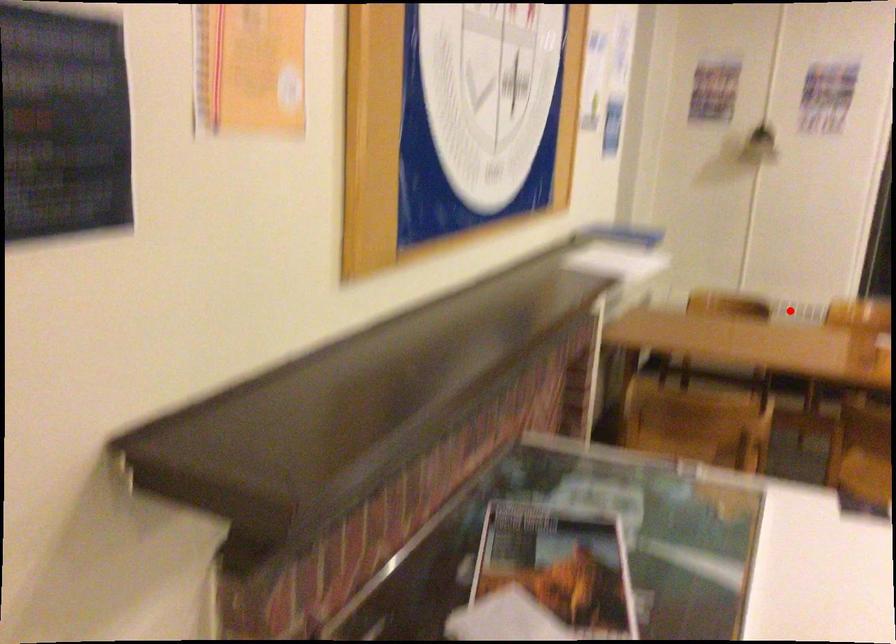
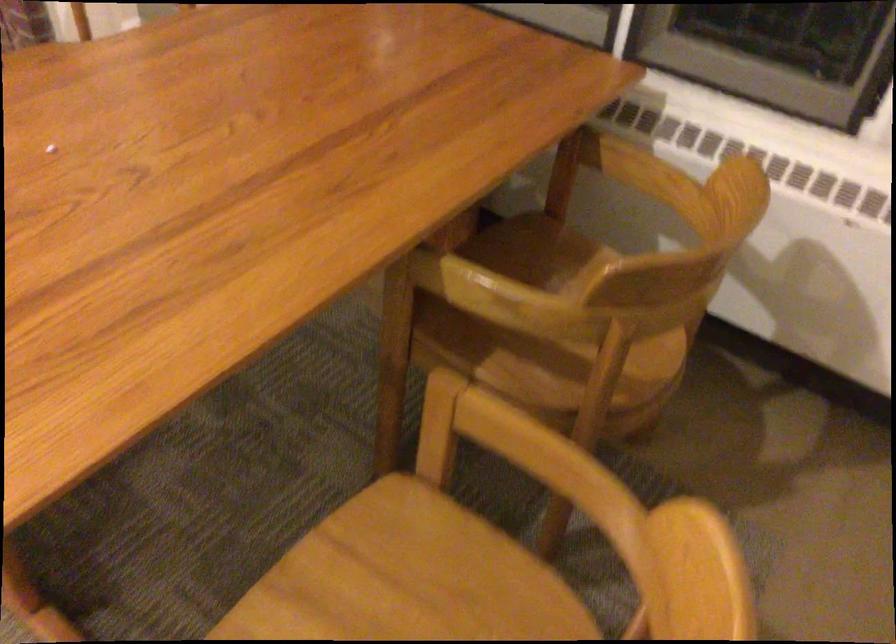
Question: A red point is marked in image1. In image2, is the corresponding 3D point closer to the camera or farther? Reply with the corresponding letter.

Choices:
 (A) The corresponding 3D point is closer.
 (B) The corresponding 3D point is farther.

Answer: (A)